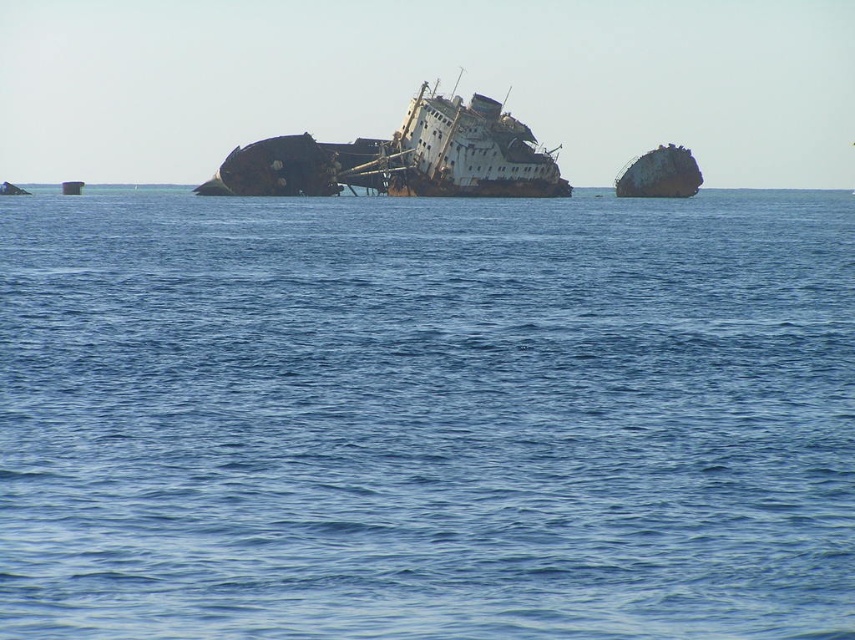
Question: Where is blue water at center located in relation to rusty metal shipwreck at right in the image?

Choices:
 (A) below
 (B) above

Answer: (A)

Question: Which point appears farthest from the camera in this image?

Choices:
 (A) (585, 554)
 (B) (535, 177)

Answer: (B)

Question: Does blue water at center have a greater width compared to rusty metal shipwreck at right?

Choices:
 (A) no
 (B) yes

Answer: (B)

Question: Which of the following is the farthest from the observer?

Choices:
 (A) (457, 156)
 (B) (189, 456)

Answer: (A)

Question: Can you confirm if blue water at center is positioned to the right of rusty metal shipwreck at right?

Choices:
 (A) yes
 (B) no

Answer: (B)

Question: Which of the following is the closest to the observer?

Choices:
 (A) rusty metal shipwreck at right
 (B) rusty metal shipwreck at center

Answer: (B)